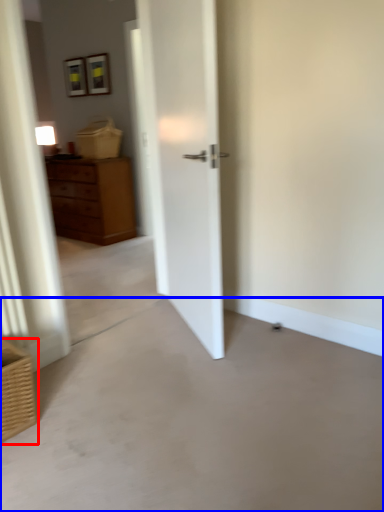
Question: Which of the following is the farthest to the observer, basket (highlighted by a red box) or concrete (highlighted by a blue box)?

Choices:
 (A) basket
 (B) concrete

Answer: (A)